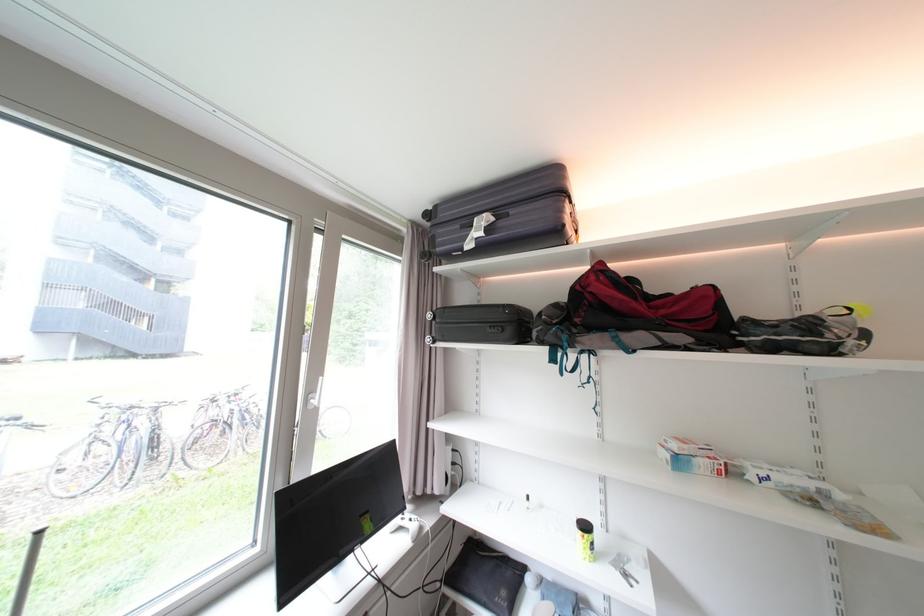
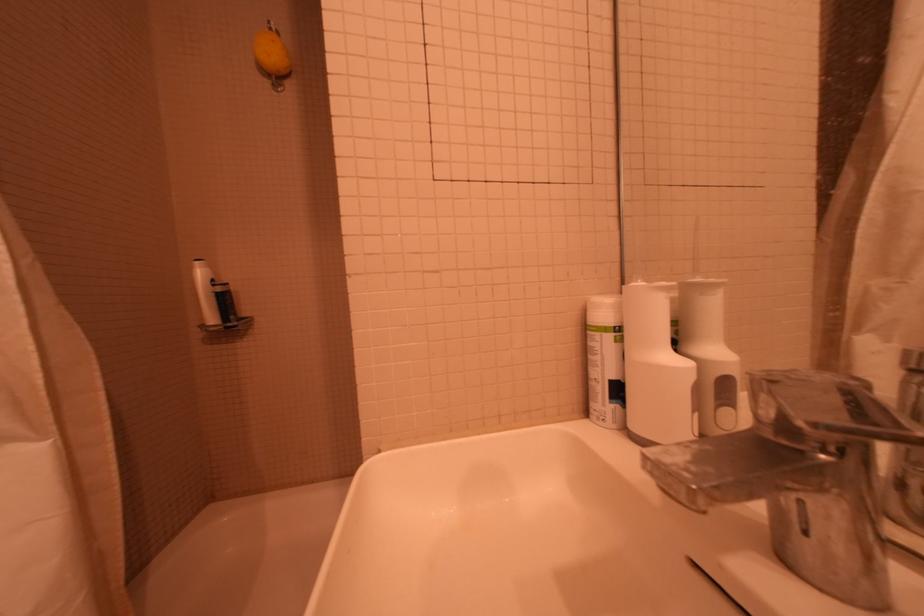
Question: I am providing you with two images of the same scene from different viewpoints. After the viewpoint changes to image2, which objects are now occluded?

Choices:
 (A) metal faucet handle
 (B) white spray can
 (C) small black bottle
 (D) yellow hardcover book

Answer: (C)